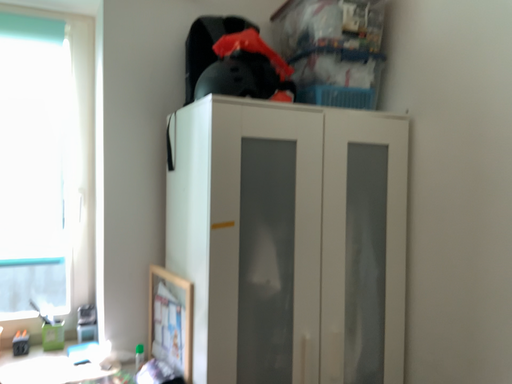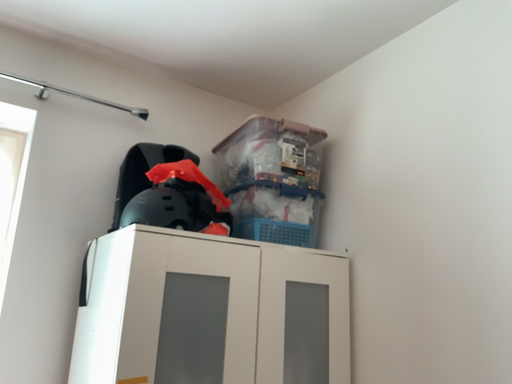
Question: Which way did the camera rotate in the video?

Choices:
 (A) rotated upward
 (B) rotated downward

Answer: (A)